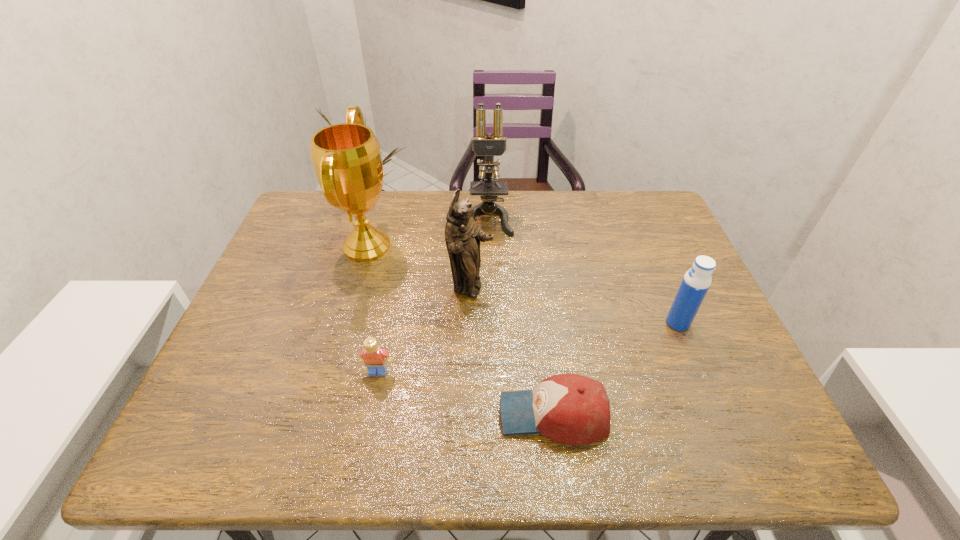
Locate an element on the screen. This screenshot has width=960, height=540. free spot located 0.180m on the back of the fourth farthest object is located at coordinates (654, 265).

Identify the location of vacant area located on the front-facing side of the fifth farthest object. (372, 406).

Locate an element on the screen. The width and height of the screenshot is (960, 540). vacant space situated on the front-facing side of the baseball cap is located at coordinates (469, 415).

Image resolution: width=960 pixels, height=540 pixels. I want to click on vacant space located 0.140m on the front-facing side of the baseball cap, so click(x=430, y=415).

The height and width of the screenshot is (540, 960). Identify the location of vacant space located on the front-facing side of the baseball cap. (390, 415).

Identify the location of award at the far edge. (346, 157).

This screenshot has height=540, width=960. I want to click on microscope at the far edge, so click(x=491, y=145).

This screenshot has height=540, width=960. Identify the location of object located in the near edge section of the desktop. (571, 409).

Find the location of a particular element. The image size is (960, 540). object at the right edge is located at coordinates (694, 286).

In the image, there is a desktop. In order to click on vacant area at the far edge in this screenshot , I will do `click(382, 196)`.